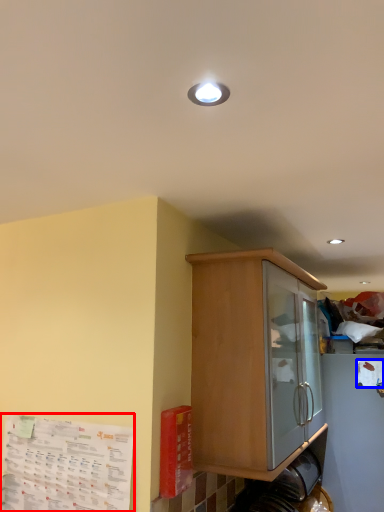
Question: Which object is further to the camera taking this photo, paper (highlighted by a red box) or paper (highlighted by a blue box)?

Choices:
 (A) paper
 (B) paper

Answer: (B)